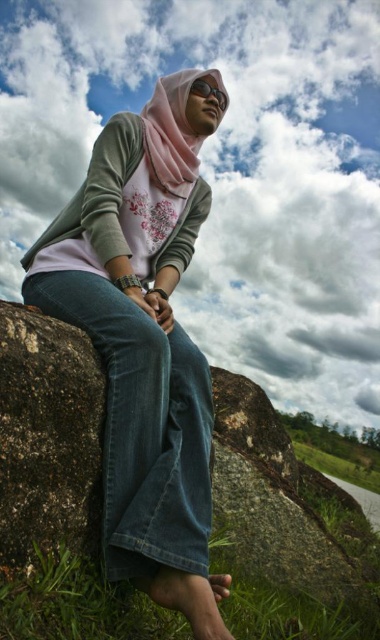
Looking at this image, you are a photographer trying to capture the pink fabric hijab at center and the rough textured rock at lower right in the same frame. Based on their positions, which object should you adjust your camera to focus on first to ensure both are in the frame?

The pink fabric hijab at center is to the left of the rough textured rock at lower right, so you should focus on the rough textured rock at lower right first to ensure both objects are within the frame.

You are a fashion designer observing the scene. You notice the pink fabric hijab at center and the green grass at lower left. Which object has a greater width?

The pink fabric hijab at center has a greater width than the green grass at lower left.